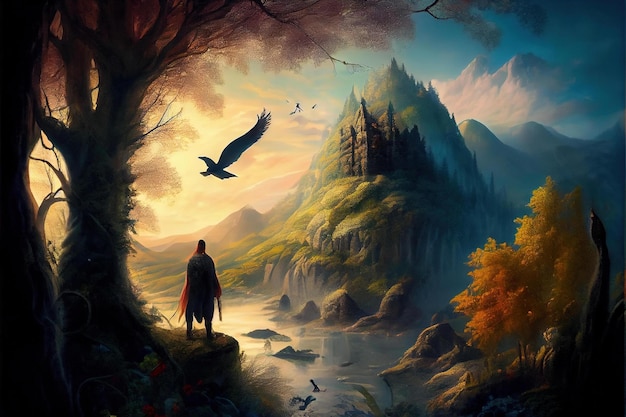
The width and height of the screenshot is (626, 417). I want to click on art, so coord(514,358).